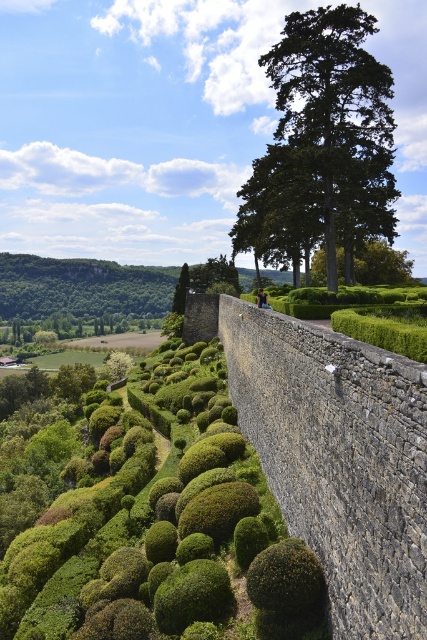
Question: Is green leafy tree at center positioned at the back of green leafy tree at upper center?

Choices:
 (A) no
 (B) yes

Answer: (A)

Question: Is green textured tree at upper center wider than green leafy tree at center?

Choices:
 (A) yes
 (B) no

Answer: (A)

Question: Among these points, which one is farthest from the camera?

Choices:
 (A) (385, 275)
 (B) (322, 234)

Answer: (A)

Question: Considering the real-world distances, which object is farthest from the green leafy tree at center?

Choices:
 (A) green leafy tree at upper center
 (B) green textured tree at upper center

Answer: (A)

Question: Considering the real-world distances, which object is farthest from the green leafy tree at upper center?

Choices:
 (A) green textured tree at upper center
 (B) green leafy tree at center

Answer: (A)

Question: Is green leafy tree at center below green leafy tree at upper center?

Choices:
 (A) no
 (B) yes

Answer: (B)